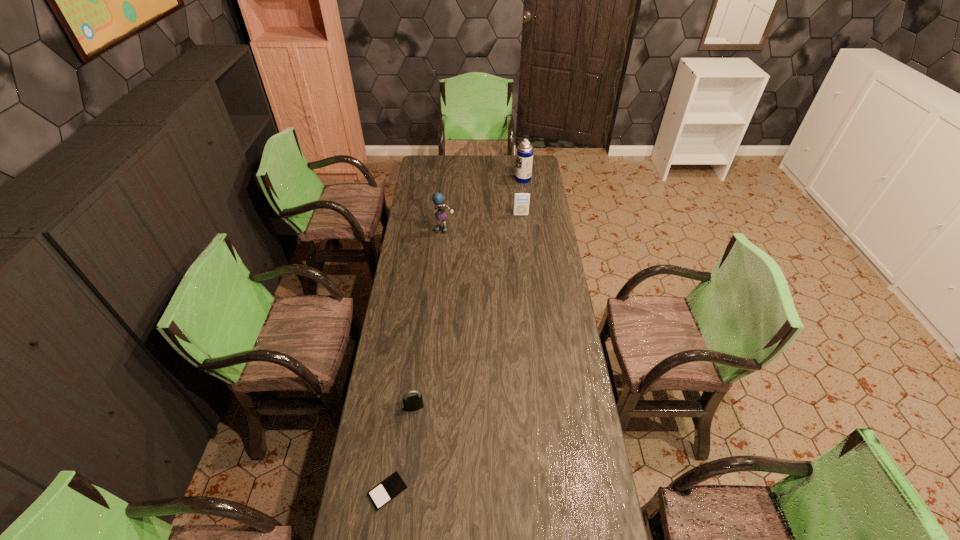
Find the location of `the farthest object`. the farthest object is located at coordinates (524, 160).

Identify the location of the third farthest object. The width and height of the screenshot is (960, 540). click(x=438, y=199).

Identify the location of the fourth nearest object. (521, 199).

At what (x,y) coordinates should I click in order to perform the action: click on the taller iPod. Please return your answer as a coordinate pair (x, y). This screenshot has width=960, height=540. Looking at the image, I should click on (521, 199).

The height and width of the screenshot is (540, 960). What are the coordinates of `padlock` in the screenshot? It's located at (412, 403).

This screenshot has width=960, height=540. What are the coordinates of `the fourth farthest object` in the screenshot? It's located at 412,403.

I want to click on the left iPod, so click(x=390, y=488).

This screenshot has width=960, height=540. What are the coordinates of `the nearer iPod` in the screenshot? It's located at (390, 488).

At what (x,y) coordinates should I click in order to perform the action: click on free location located on the label side of the farthest object. Please return your answer as a coordinate pair (x, y). The height and width of the screenshot is (540, 960). Looking at the image, I should click on (492, 179).

I want to click on vacant position located 0.270m on the label side of the farthest object, so click(469, 179).